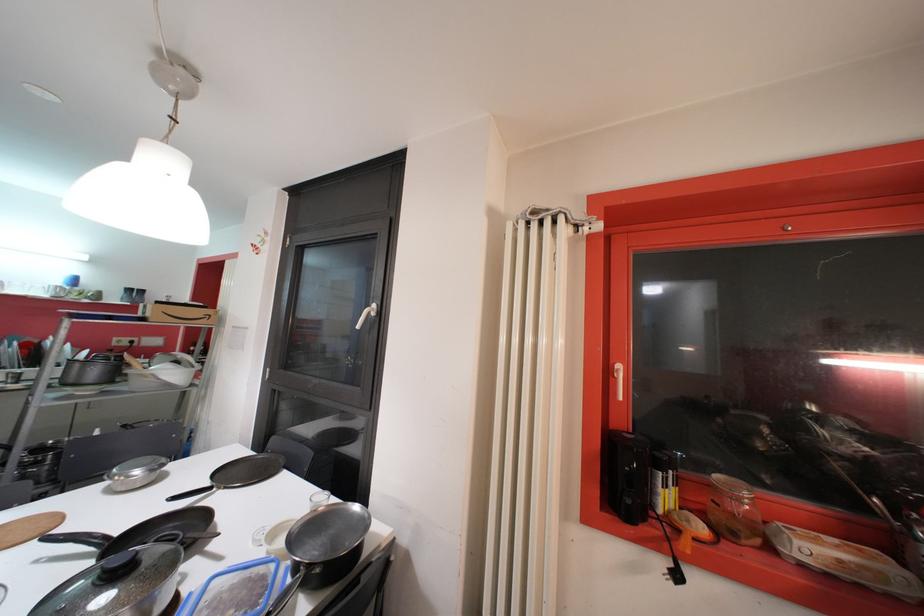
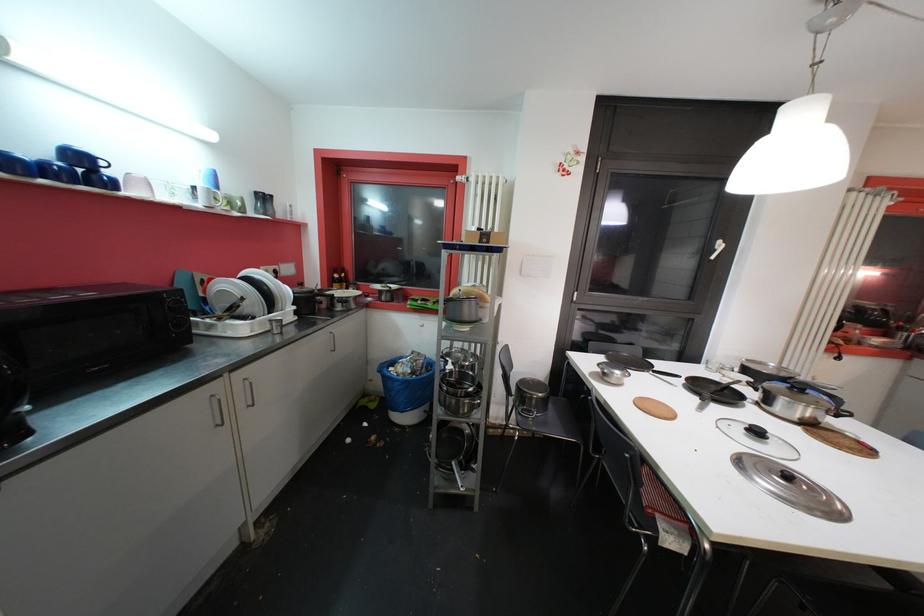
Question: In a continuous first-person perspective shot, in which direction is the camera moving?

Choices:
 (A) Left
 (B) Right
 (C) Forward
 (D) Backward

Answer: (A)